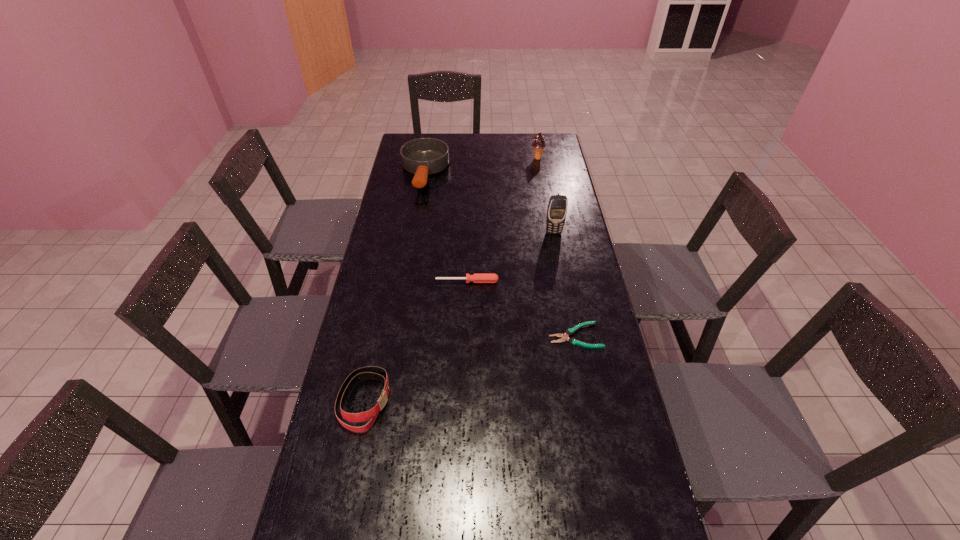
I want to click on cellular telephone present at the right edge, so click(x=557, y=207).

You are a GUI agent. You are given a task and a screenshot of the screen. Output one action in this format:
    pyautogui.click(x=<x>, y=<y>)
    Task: Click on the icecream that is at the right edge
    The image size is (960, 540).
    Given the screenshot: What is the action you would take?
    pyautogui.click(x=538, y=143)

Where is `pliers positioned at the right edge`? pliers positioned at the right edge is located at coordinates (564, 337).

Identify the location of object present at the far left corner. This screenshot has height=540, width=960. (423, 156).

The height and width of the screenshot is (540, 960). What are the coordinates of `object positioned at the far right corner` in the screenshot? It's located at (538, 143).

Where is `free space at the far edge of the desktop`? free space at the far edge of the desktop is located at coordinates (510, 153).

The width and height of the screenshot is (960, 540). In the image, there is a desktop. What are the coordinates of `free space at the left edge` in the screenshot? It's located at (412, 249).

Locate an element on the screen. free space at the right edge is located at coordinates (562, 184).

This screenshot has height=540, width=960. Identify the location of empty space that is in between the tallest object and the pliers. (564, 284).

Where is `vacant area that lies between the fourth tallest object and the icecream`? vacant area that lies between the fourth tallest object and the icecream is located at coordinates (451, 280).